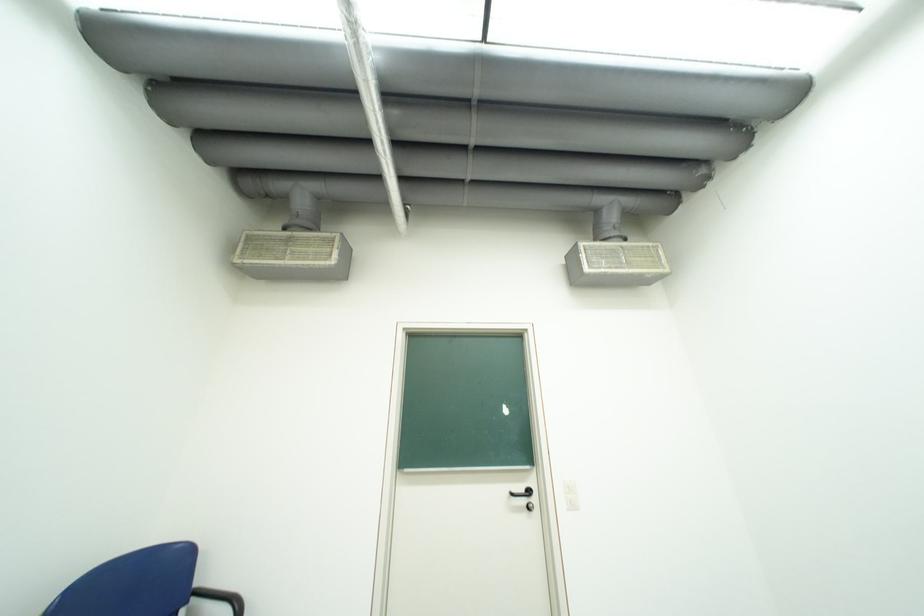
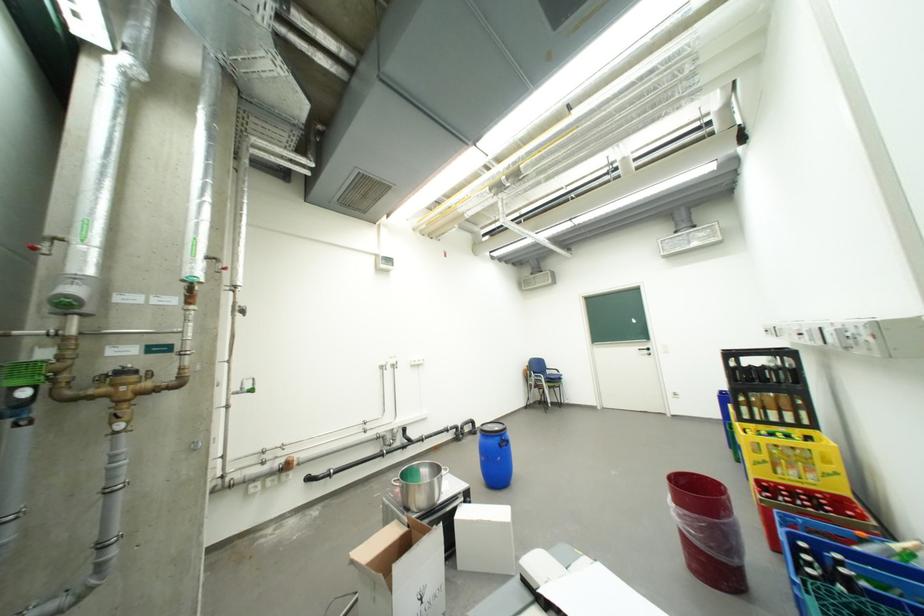
Where in the second image is the point corresponding to pixel 523 495 from the first image?

(650, 351)